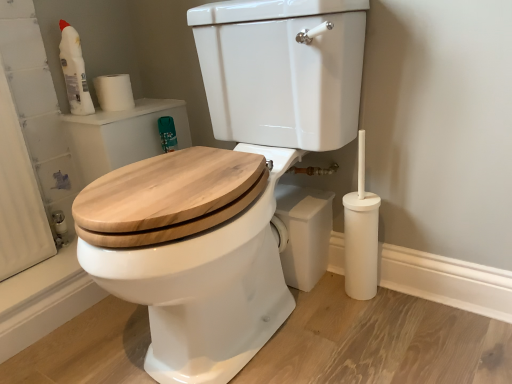
Find the location of a particular element. The image size is (512, 384). free spot to the left of white plastic toilet brush at lower right is located at coordinates (320, 302).